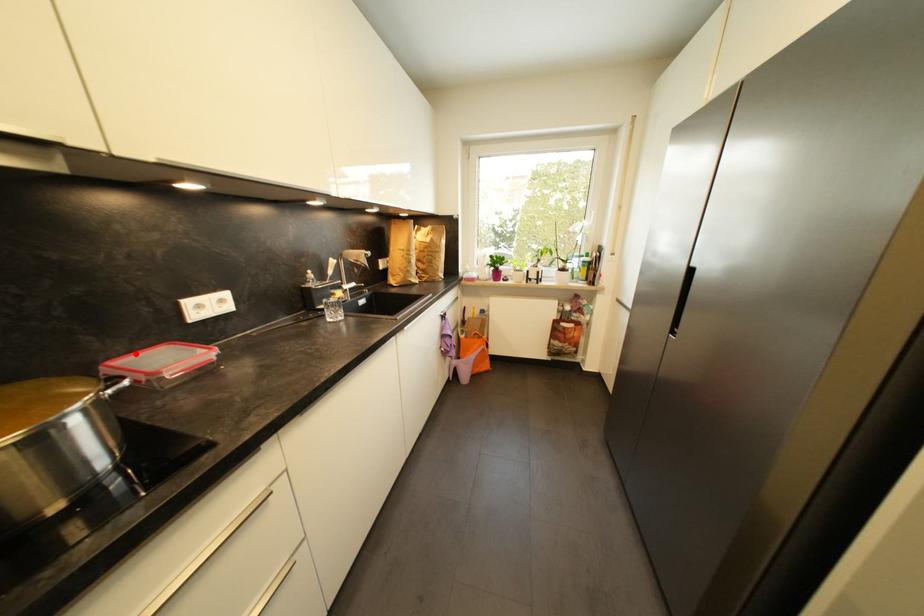
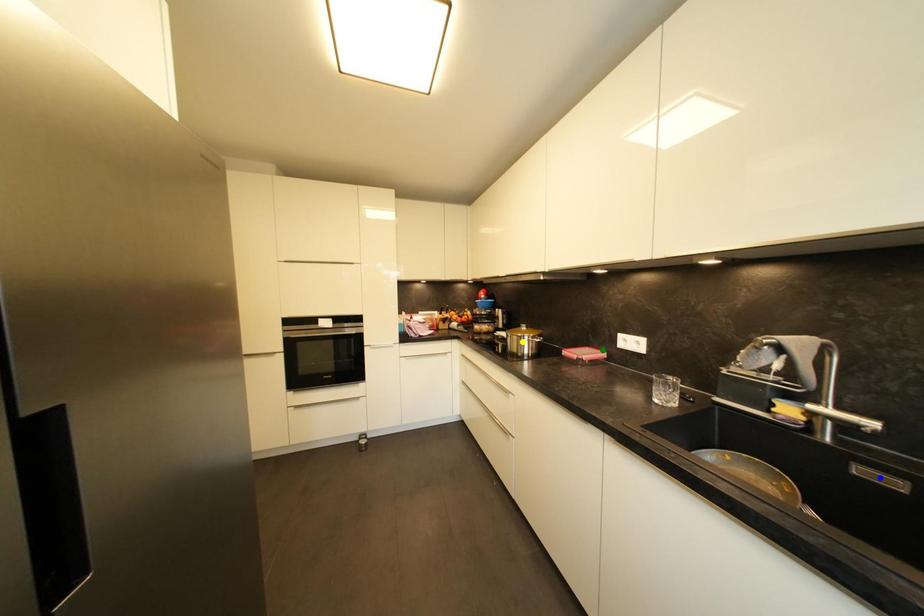
Question: I am providing you with two images of the same scene from different viewpoints. A red point is marked on the first image. You are given multiple points on the second image. In image 2, which mark is for the same physical point as the one in image 1?

Choices:
 (A) yellow point
 (B) blue point
 (C) green point

Answer: (C)